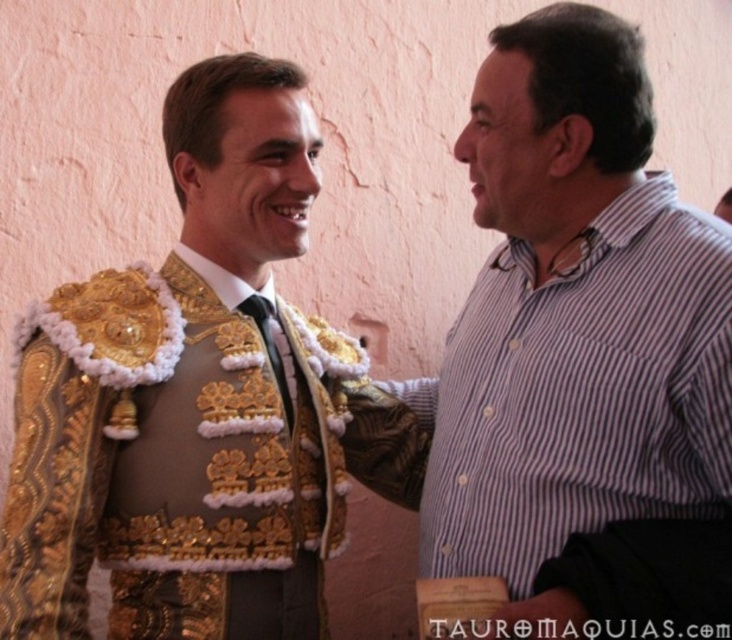
Does gold embroidered jacket at left have a greater height compared to black satin tie at center?

Indeed, gold embroidered jacket at left has a greater height compared to black satin tie at center.

Which is in front, point (288, 531) or point (272, 362)?

Point (288, 531) is in front.

Identify the location of gold embroidered jacket at left. (195, 403).

Does gold embroidered jacket at left have a lesser height compared to striped cotton shirt at right?

No.

Which is in front, point (186, 516) or point (504, 333)?

Point (186, 516)

The image size is (732, 640). I want to click on gold embroidered jacket at left, so click(195, 403).

Where is `gold embroidered jacket at left`? The image size is (732, 640). gold embroidered jacket at left is located at coordinates (195, 403).

Which is more to the right, striped cotton shirt at right or black satin tie at center?

striped cotton shirt at right is more to the right.

Does point (671, 484) come closer to viewer compared to point (277, 356)?

Yes.

Identify the location of striped cotton shirt at right. (580, 349).